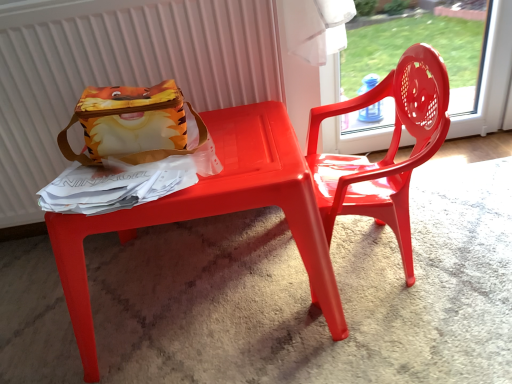
Question: Does matte fabric lunchbox at upper left lie in front of matte plastic radiator at upper left?

Choices:
 (A) no
 (B) yes

Answer: (B)

Question: From a real-world perspective, is matte fabric lunchbox at upper left on top of matte plastic radiator at upper left?

Choices:
 (A) yes
 (B) no

Answer: (A)

Question: From the image's perspective, does matte fabric lunchbox at upper left appear lower than matte plastic radiator at upper left?

Choices:
 (A) yes
 (B) no

Answer: (A)

Question: Does matte fabric lunchbox at upper left have a lesser width compared to matte plastic radiator at upper left?

Choices:
 (A) no
 (B) yes

Answer: (A)

Question: Is matte fabric lunchbox at upper left to the left of matte plastic radiator at upper left from the viewer's perspective?

Choices:
 (A) no
 (B) yes

Answer: (A)

Question: Considering the positions of matte fabric lunchbox at upper left and matte plastic table at center in the image, is matte fabric lunchbox at upper left taller or shorter than matte plastic table at center?

Choices:
 (A) tall
 (B) short

Answer: (B)

Question: Would you say matte fabric lunchbox at upper left is inside or outside matte plastic table at center?

Choices:
 (A) inside
 (B) outside

Answer: (B)

Question: Considering the positions of matte fabric lunchbox at upper left and matte plastic table at center in the image, is matte fabric lunchbox at upper left bigger or smaller than matte plastic table at center?

Choices:
 (A) small
 (B) big

Answer: (A)

Question: From the image's perspective, is matte fabric lunchbox at upper left located above or below matte plastic table at center?

Choices:
 (A) above
 (B) below

Answer: (A)

Question: Would you say matte plastic radiator at upper left is to the left or to the right of glossy plastic chair at right in the picture?

Choices:
 (A) left
 (B) right

Answer: (A)

Question: From the image's perspective, is matte plastic radiator at upper left above or below glossy plastic chair at right?

Choices:
 (A) above
 (B) below

Answer: (A)

Question: Is matte plastic radiator at upper left wider or thinner than glossy plastic chair at right?

Choices:
 (A) wide
 (B) thin

Answer: (B)

Question: From their relative heights in the image, would you say matte plastic radiator at upper left is taller or shorter than glossy plastic chair at right?

Choices:
 (A) tall
 (B) short

Answer: (A)

Question: Looking at the image, does glossy plastic chair at right seem bigger or smaller compared to matte plastic radiator at upper left?

Choices:
 (A) small
 (B) big

Answer: (B)

Question: Considering the positions of glossy plastic chair at right and matte plastic radiator at upper left in the image, is glossy plastic chair at right taller or shorter than matte plastic radiator at upper left?

Choices:
 (A) short
 (B) tall

Answer: (A)